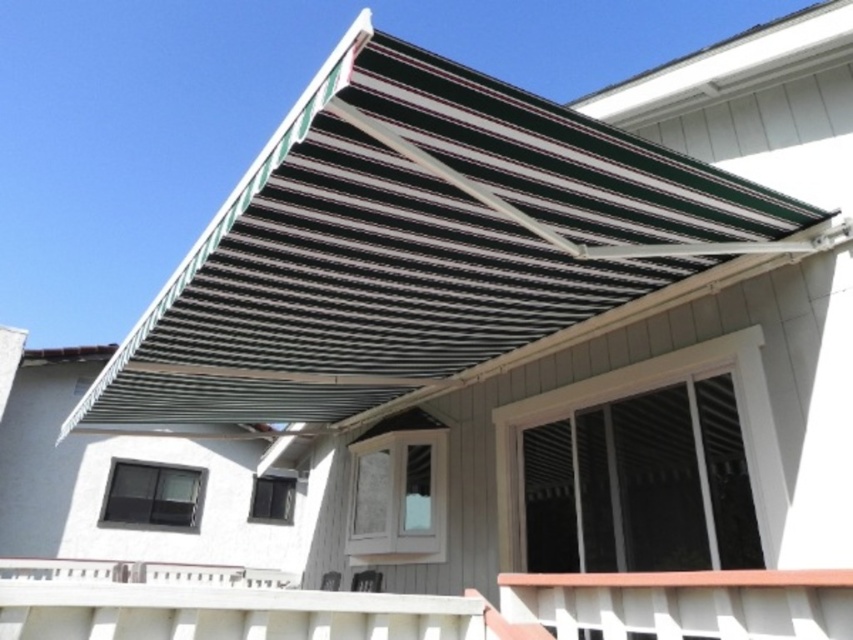
Question: Which point is farther to the camera?

Choices:
 (A) white plastic balustrade at lower center
 (B) white wooden porch at lower center
 (C) black striped awning at upper center
 (D) white plastic balustrade at lower right

Answer: (A)

Question: Where is black striped awning at upper center located in relation to white plastic balustrade at lower right in the image?

Choices:
 (A) right
 (B) left

Answer: (B)

Question: Is white plastic balustrade at lower right to the right of white plastic balustrade at lower center from the viewer's perspective?

Choices:
 (A) no
 (B) yes

Answer: (B)

Question: Which object appears closest to the camera in this image?

Choices:
 (A) white plastic balustrade at lower center
 (B) white wooden porch at lower center
 (C) white plastic balustrade at lower right
 (D) black striped awning at upper center

Answer: (C)

Question: Does black striped awning at upper center appear on the right side of white plastic balustrade at lower right?

Choices:
 (A) no
 (B) yes

Answer: (A)

Question: Which point appears closest to the camera in this image?

Choices:
 (A) (724, 598)
 (B) (173, 572)
 (C) (291, 618)
 (D) (688, 216)

Answer: (A)